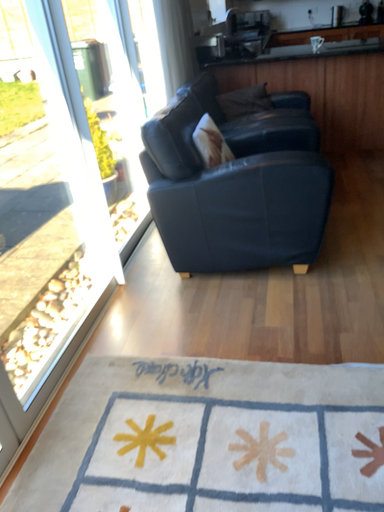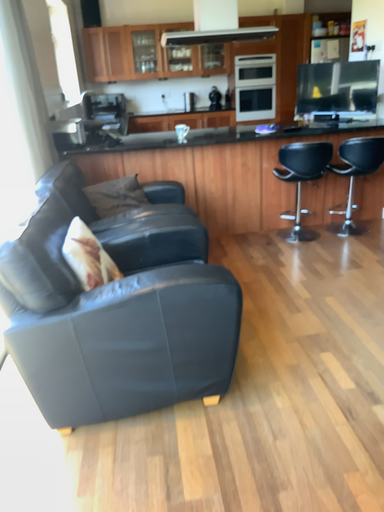
Question: How did the camera likely rotate when shooting the video?

Choices:
 (A) rotated upward
 (B) rotated downward

Answer: (A)